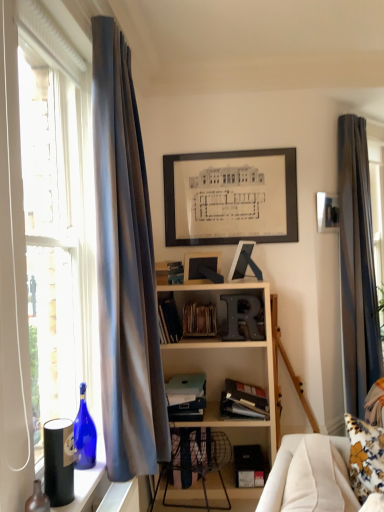
Question: Is blue glass bottle at window, the 1th bottle from the back, looking in the opposite direction of hardcover book at center, the 2th book from the bottom?

Choices:
 (A) no
 (B) yes

Answer: (A)

Question: Is blue glass bottle at window, the 1th bottle from the back, outside hardcover book at center, acting as the fourth book starting from the top?

Choices:
 (A) yes
 (B) no

Answer: (A)

Question: From the image's perspective, is blue glass bottle at window, which is counted as the 2th bottle, starting from the front, over hardcover book at center, acting as the fourth book starting from the top?

Choices:
 (A) no
 (B) yes

Answer: (B)

Question: From a real-world perspective, is blue glass bottle at window, which is counted as the 2th bottle, starting from the front, physically above hardcover book at center, acting as the fourth book starting from the top?

Choices:
 (A) no
 (B) yes

Answer: (B)

Question: Does blue glass bottle at window, the 1th bottle from the back, appear on the right side of hardcover book at center, the 2th book from the bottom?

Choices:
 (A) yes
 (B) no

Answer: (B)

Question: Is blue glass bottle at window, the 1th bottle from the back, placed right next to hardcover book at center, acting as the fourth book starting from the top?

Choices:
 (A) no
 (B) yes

Answer: (A)

Question: From the image's perspective, is matte glass bottle at lower left, which appears as the 2th bottle when viewed from the back, beneath hardcover book at center, the 2th book from the bottom?

Choices:
 (A) yes
 (B) no

Answer: (B)

Question: Can you confirm if matte glass bottle at lower left, the 1th bottle positioned from the front, is shorter than hardcover book at center, the 2th book from the bottom?

Choices:
 (A) yes
 (B) no

Answer: (A)

Question: Can you confirm if matte glass bottle at lower left, which appears as the 2th bottle when viewed from the back, is thinner than hardcover book at center, acting as the fourth book starting from the top?

Choices:
 (A) yes
 (B) no

Answer: (A)

Question: Is matte glass bottle at lower left, which appears as the 2th bottle when viewed from the back, aimed at hardcover book at center, acting as the fourth book starting from the top?

Choices:
 (A) no
 (B) yes

Answer: (A)

Question: Considering the relative sizes of matte glass bottle at lower left, the 1th bottle positioned from the front, and hardcover book at center, the 2th book from the bottom, in the image provided, is matte glass bottle at lower left, the 1th bottle positioned from the front, smaller than hardcover book at center, the 2th book from the bottom,?

Choices:
 (A) no
 (B) yes

Answer: (B)

Question: Is matte glass bottle at lower left, the 1th bottle positioned from the front, next to hardcover book at center, the 2th book from the bottom?

Choices:
 (A) yes
 (B) no

Answer: (B)

Question: Is the position of matte glass bottle at lower left, which appears as the 2th bottle when viewed from the back, more distant than that of silky blue curtain at right, acting as the 1th curtain starting from the right?

Choices:
 (A) yes
 (B) no

Answer: (B)